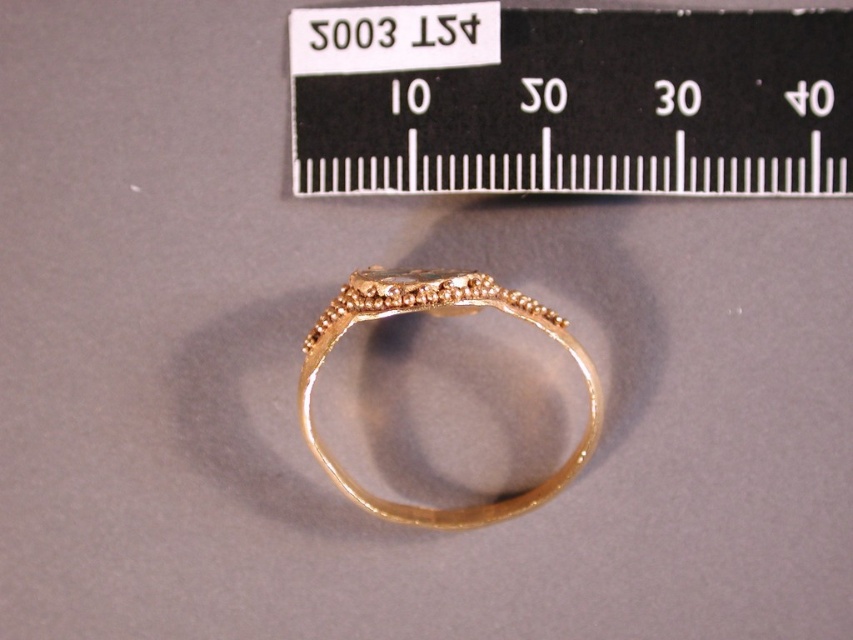
Who is higher up, black plastic ruler at upper center or gold textured ring at center?

black plastic ruler at upper center

Is black plastic ruler at upper center behind gold textured ring at center?

That is True.

Image resolution: width=853 pixels, height=640 pixels. Describe the element at coordinates (570, 100) in the screenshot. I see `black plastic ruler at upper center` at that location.

The height and width of the screenshot is (640, 853). What are the coordinates of `black plastic ruler at upper center` in the screenshot? It's located at (570, 100).